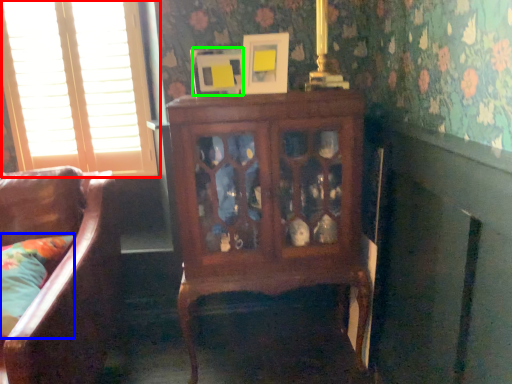
Question: Estimate the real-world distances between objects in this image. Which object is farther from window (highlighted by a red box), pillow (highlighted by a blue box) or picture frame (highlighted by a green box)?

Choices:
 (A) pillow
 (B) picture frame

Answer: (A)